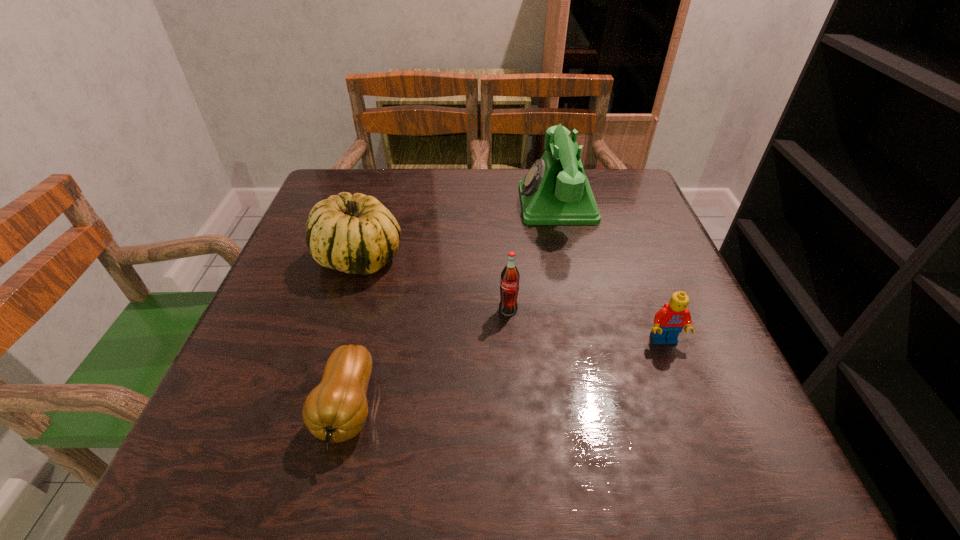
Find the location of `vacant space in between the third object from right to left and the taller gourd`. vacant space in between the third object from right to left and the taller gourd is located at coordinates (434, 284).

The image size is (960, 540). Identify the location of free space between the third nearest object and the farther gourd. (434, 284).

At what (x,y) coordinates should I click in order to perform the action: click on free point between the shorter gourd and the taller gourd. Please return your answer as a coordinate pair (x, y). The width and height of the screenshot is (960, 540). Looking at the image, I should click on (353, 333).

This screenshot has height=540, width=960. What are the coordinates of `free space between the rightmost object and the fourth object from left to right` in the screenshot? It's located at (611, 272).

Locate an element on the screen. The height and width of the screenshot is (540, 960). free space between the nearer gourd and the second nearest object is located at coordinates (506, 375).

Select which object is the third closest to the taller gourd. Please provide its 2D coordinates. Your answer should be formatted as a tuple, i.e. [(x, y)], where the tuple contains the x and y coordinates of a point satisfying the conditions above.

[(555, 191)]

Choose which object is the nearest neighbor to the third nearest object. Please provide its 2D coordinates. Your answer should be formatted as a tuple, i.e. [(x, y)], where the tuple contains the x and y coordinates of a point satisfying the conditions above.

[(356, 234)]

Find the location of a particular element. free location that satisfies the following two spatial constraints: 1. on the dial of the second object from right to left; 2. on the stem side of the shortest object is located at coordinates (603, 409).